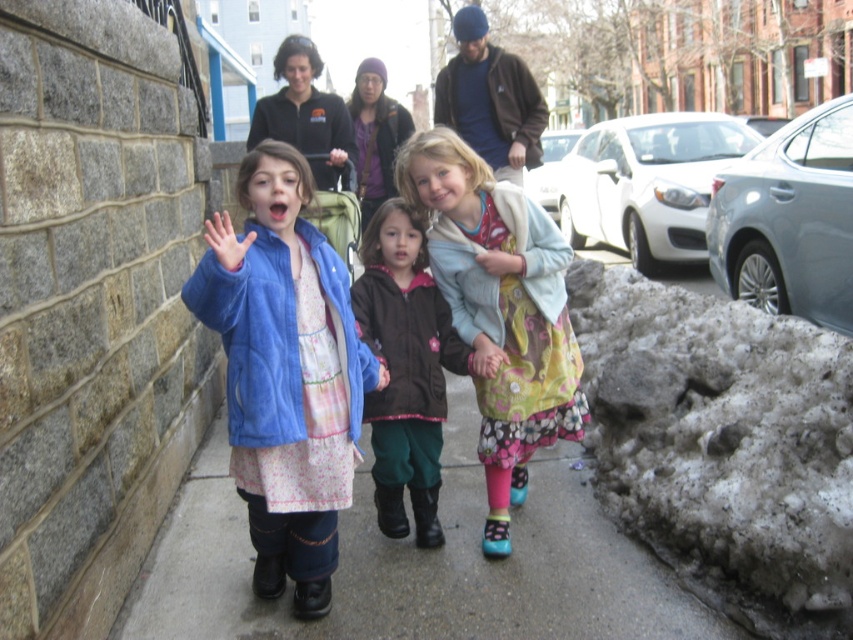
Based on the photo, can you confirm if smooth concrete sidewalk at center is positioned above floral fabric dress at center?

Incorrect, smooth concrete sidewalk at center is not positioned above floral fabric dress at center.

Between point (479, 472) and point (432, 545), which one is positioned in front?

Positioned in front is point (432, 545).

At what (x,y) coordinates should I click in order to perform the action: click on smooth concrete sidewalk at center. Please return your answer as a coordinate pair (x, y). The height and width of the screenshot is (640, 853). Looking at the image, I should click on (421, 564).

Between floral dress at center and floral fabric dress at center, which one has less height?

floral fabric dress at center is shorter.

Does floral dress at center have a smaller size compared to floral fabric dress at center?

Actually, floral dress at center might be larger than floral fabric dress at center.

Who is more forward, [437,246] or [370,445]?

Positioned in front is point [437,246].

Where is `floral dress at center`? This screenshot has height=640, width=853. floral dress at center is located at coordinates (498, 310).

Based on the photo, is smooth concrete sidewalk at center further to camera compared to matte blue jacket at center?

Yes, smooth concrete sidewalk at center is behind matte blue jacket at center.

Image resolution: width=853 pixels, height=640 pixels. What do you see at coordinates (421, 564) in the screenshot? I see `smooth concrete sidewalk at center` at bounding box center [421, 564].

Image resolution: width=853 pixels, height=640 pixels. I want to click on smooth concrete sidewalk at center, so click(421, 564).